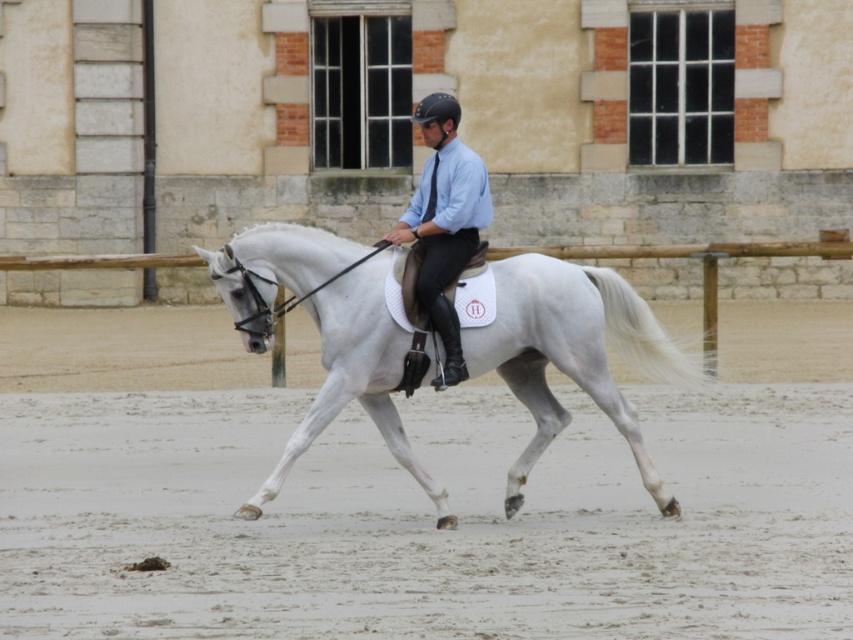
Question: Is sandy dirt track at center wider than matte blue shirt at center?

Choices:
 (A) no
 (B) yes

Answer: (B)

Question: From the image, what is the correct spatial relationship of sandy dirt track at center in relation to white glossy horse at center?

Choices:
 (A) right
 (B) left

Answer: (B)

Question: Estimate the real-world distances between objects in this image. Which object is farther from the white glossy horse at center?

Choices:
 (A) sandy dirt track at center
 (B) matte blue shirt at center

Answer: (A)

Question: Does white glossy horse at center have a greater width compared to matte blue shirt at center?

Choices:
 (A) no
 (B) yes

Answer: (B)

Question: Among these points, which one is farthest from the camera?

Choices:
 (A) (271, 227)
 (B) (480, 218)

Answer: (B)

Question: Which of these objects is positioned farthest from the matte blue shirt at center?

Choices:
 (A) white glossy horse at center
 (B) sandy dirt track at center

Answer: (B)